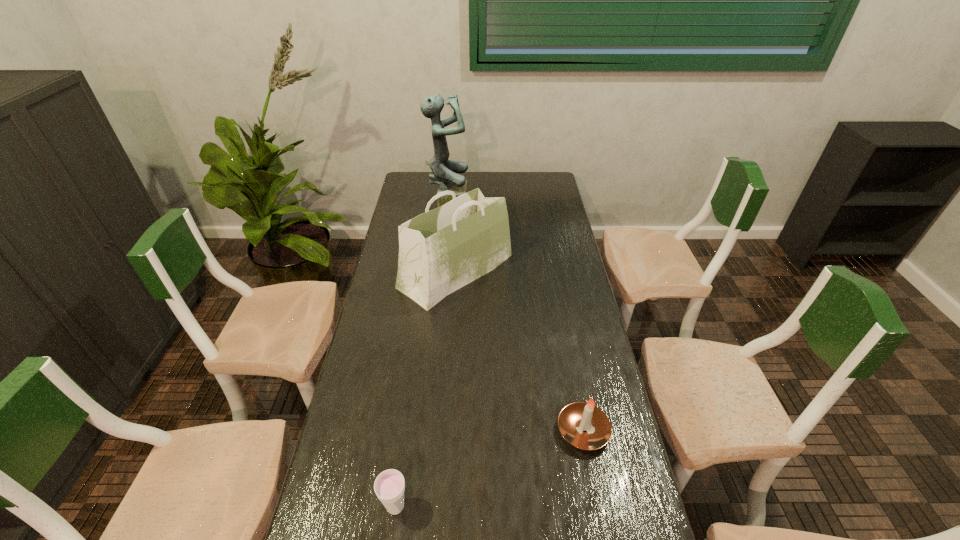
At what (x,y) coordinates should I click in order to perform the action: click on vacant space located 0.210m on the left of the candle. Please return your answer as a coordinate pair (x, y). Looking at the image, I should click on (482, 430).

Where is `vacant area situated 0.100m on the left of the cup`? vacant area situated 0.100m on the left of the cup is located at coordinates (341, 507).

Locate an element on the screen. The height and width of the screenshot is (540, 960). object located at the far edge is located at coordinates (444, 172).

At what (x,y) coordinates should I click in order to perform the action: click on sculpture that is at the left edge. Please return your answer as a coordinate pair (x, y). This screenshot has height=540, width=960. Looking at the image, I should click on (444, 172).

Locate an element on the screen. Image resolution: width=960 pixels, height=540 pixels. grocery bag that is positioned at the left edge is located at coordinates (440, 251).

Image resolution: width=960 pixels, height=540 pixels. What are the coordinates of `cup at the left edge` in the screenshot? It's located at (389, 486).

Locate an element on the screen. object that is at the right edge is located at coordinates (575, 418).

This screenshot has height=540, width=960. I want to click on object that is at the far left corner, so click(444, 172).

Image resolution: width=960 pixels, height=540 pixels. What are the coordinates of `free space at the far edge` in the screenshot? It's located at (484, 176).

Locate an element on the screen. Image resolution: width=960 pixels, height=540 pixels. vacant space at the left edge of the desktop is located at coordinates pos(379,292).